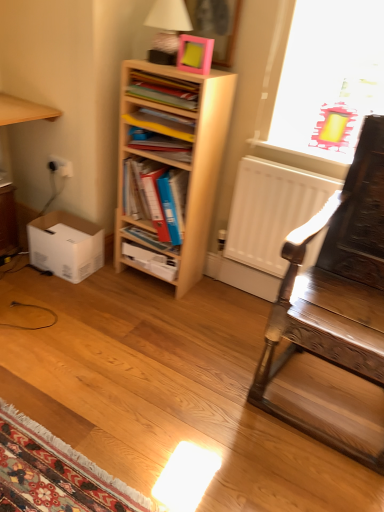
Question: Based on their sizes in the image, would you say matte plastic book at upper center, the 1th book from the top, is bigger or smaller than blue plastic folder at center, which ranks as the third book in bottom-to-top order?

Choices:
 (A) small
 (B) big

Answer: (A)

Question: Considering the positions of matte plastic book at upper center, the 1th book from the top, and blue plastic folder at center, which ranks as the third book in bottom-to-top order, in the image, is matte plastic book at upper center, the 1th book from the top, taller or shorter than blue plastic folder at center, which ranks as the third book in bottom-to-top order,?

Choices:
 (A) tall
 (B) short

Answer: (B)

Question: Which object is the farthest from the matte white table lamp at upper center?

Choices:
 (A) wooden shelf at upper left
 (B) blue plastic folder at center, the 3th book viewed from the top
 (C) pink matte picture frame at upper center
 (D) matte plastic book at upper center, which is the 5th book in bottom-to-top order
 (E) blue hardcover book at center, which is the fourth book in top-to-bottom order

Answer: (E)

Question: Which object is positioned closest to the white cardboard box at lower left?

Choices:
 (A) hardcover book at center, the 5th book positioned from the top
 (B) matte yellow folder at center, which is the second book from top to bottom
 (C) matte plastic book at upper center, the 1th book from the top
 (D) wooden shelf at upper left
 (E) light wood bookshelf at center

Answer: (A)